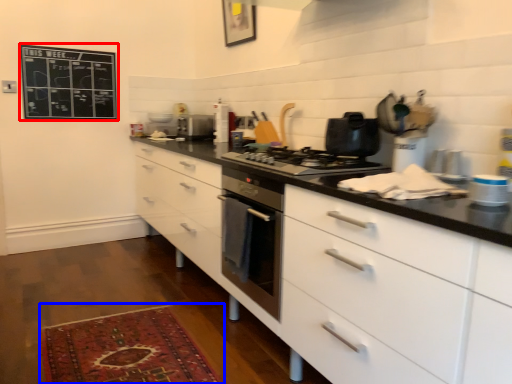
Question: Which point is closer to the camera, bulletin board (highlighted by a red box) or mat (highlighted by a blue box)?

Choices:
 (A) bulletin board
 (B) mat

Answer: (B)